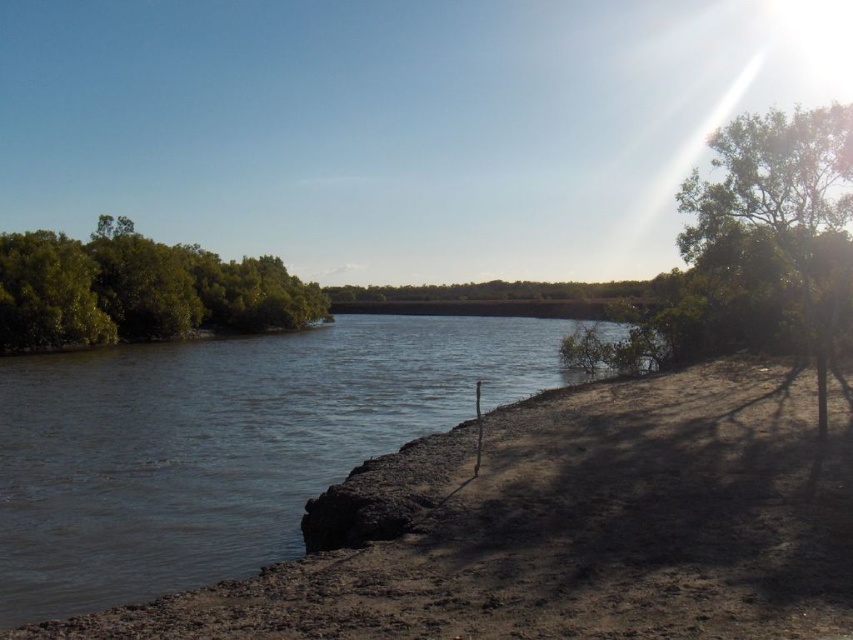
Between point (190, 486) and point (270, 276), which one is positioned behind?

Point (270, 276)

Is brown sedimentary river at center wider than green leafy trees at left?

Yes.

What are the coordinates of `brown sedimentary river at center` in the screenshot? It's located at (223, 444).

Is point (426, 353) positioned in front of point (839, 246)?

No, it is not.

Who is more distant from viewer, (96, 458) or (780, 144)?

The point (780, 144) is behind.

Where is `brown sedimentary river at center`? brown sedimentary river at center is located at coordinates (223, 444).

Can you confirm if green leafy trees at left is shorter than green leafy tree at right?

Yes.

Measure the distance between point [88,243] and camera.

Point [88,243] is 275.15 feet from camera.

Where is `green leafy trees at left`? Image resolution: width=853 pixels, height=640 pixels. green leafy trees at left is located at coordinates (137, 289).